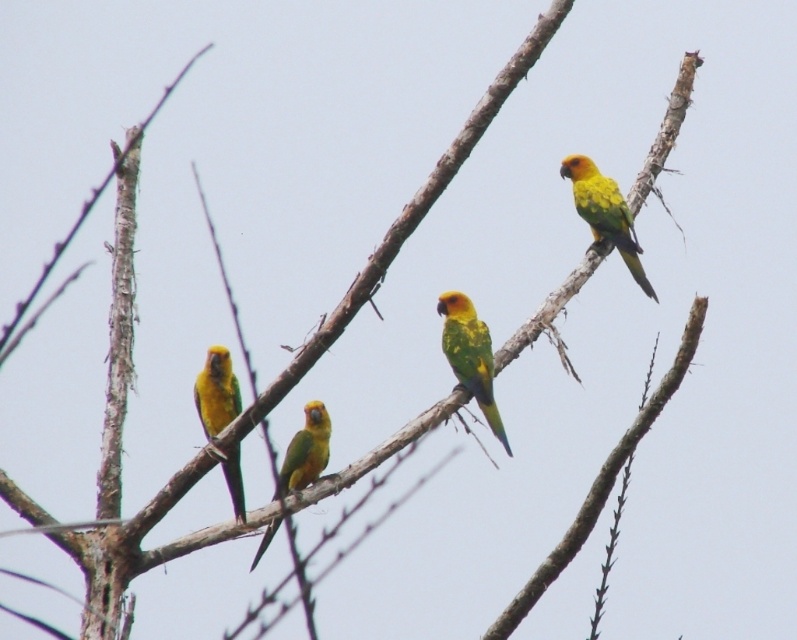
Question: Is yellow-green parrot at center in front of yellow-green parrot at left?

Choices:
 (A) yes
 (B) no

Answer: (B)

Question: Is yellow-green parrot at center positioned behind yellow-green parrot at upper right?

Choices:
 (A) yes
 (B) no

Answer: (B)

Question: Among these objects, which one is farthest from the camera?

Choices:
 (A) yellow-green parrot at center
 (B) yellow-green glossy parrot at center

Answer: (A)

Question: Which point appears farthest from the camera in this image?

Choices:
 (A) (615, 227)
 (B) (312, 458)
 (C) (224, 356)
 (D) (511, 452)

Answer: (A)

Question: Based on their relative distances, which object is nearer to the yellow-green glossy parrot at center?

Choices:
 (A) yellow-green parrot at upper right
 (B) yellow-green parrot at center
 (C) yellow-green parrot at left

Answer: (C)

Question: Is yellow-green parrot at center to the left of yellow-green glossy parrot at center from the viewer's perspective?

Choices:
 (A) yes
 (B) no

Answer: (B)